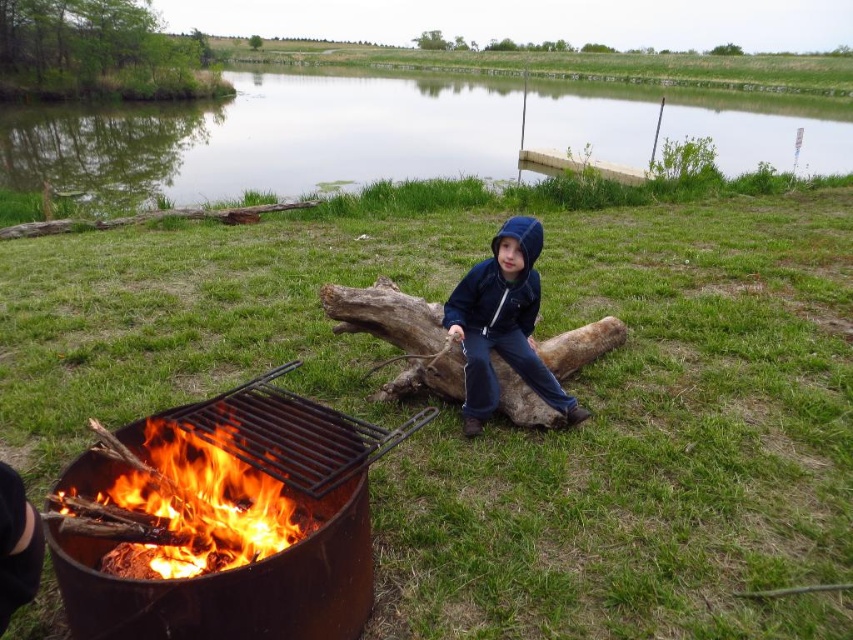
Which of these two, rusty metal fire pit at lower left or flaming wood at lower left, stands taller?

With more height is rusty metal fire pit at lower left.

Is rusty metal fire pit at lower left shorter than flaming wood at lower left?

In fact, rusty metal fire pit at lower left may be taller than flaming wood at lower left.

Image resolution: width=853 pixels, height=640 pixels. What are the coordinates of `rusty metal fire pit at lower left` in the screenshot? It's located at (256, 561).

Is point (502, 369) closer to camera compared to point (537, 355)?

Yes, point (502, 369) is closer to viewer.

Is point (395, 308) positioned behind point (468, 275)?

That is True.

Who is more forward, (x=392, y=380) or (x=527, y=296)?

Point (x=527, y=296) is in front.

At what (x,y) coordinates should I click in order to perform the action: click on brown rough wood log at center. Please return your answer as a coordinate pair (x, y). This screenshot has height=640, width=853. Looking at the image, I should click on (399, 336).

Is the position of rusty metal fire pit at lower left more distant than that of brown rough wood log at center?

That is False.

Which is more to the right, rusty metal fire pit at lower left or brown rough wood log at center?

Positioned to the right is brown rough wood log at center.

Which is in front, point (260, 572) or point (509, 404)?

Point (260, 572) is in front.

Locate an element on the screen. The image size is (853, 640). rusty metal fire pit at lower left is located at coordinates 256,561.